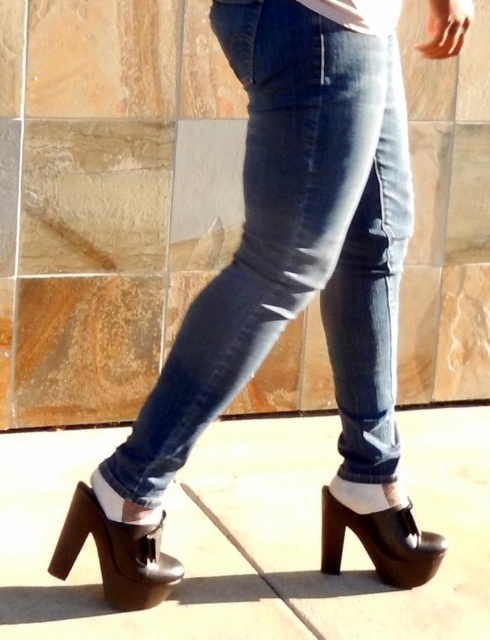
You are a fashion designer analyzing the image. Where is the denim at center positioned in relation to the tiled wall background?

The denim at center is positioned at coordinates point (295,243).

You are taking a photo of the scene and want to focus on the point that is closer to the camera. Which point should you choose between point (340, 109) and point (145, 561)?

Point (340, 109) is closer to the camera, so you should choose that point to focus on.

You are a fashion designer trying to create a new outfit. You have a denim at center and a black leather sandal at lower center in your design. Which item should you adjust in height to ensure they are the same height?

The denim at center is much taller than the black leather sandal at lower center. To make them the same height, you should shorten the denim at center or raise the black leather sandal at lower center.